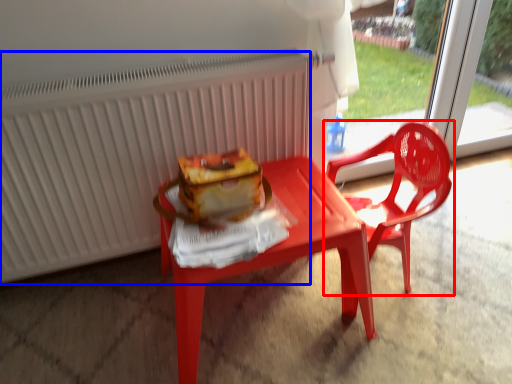
Question: Among these objects, which one is nearest to the camera, chair (highlighted by a red box) or radiator (highlighted by a blue box)?

Choices:
 (A) chair
 (B) radiator

Answer: (B)